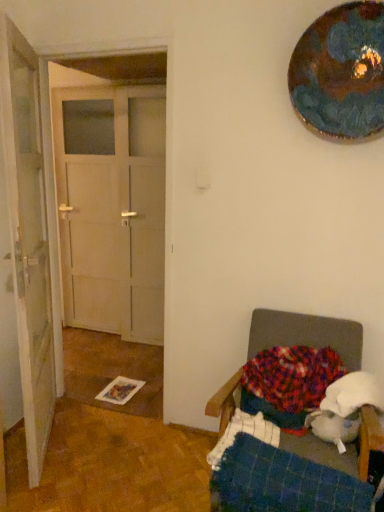
Locate an element on the screen. This screenshot has height=512, width=384. empty space that is to the right of white wooden door at left, acting as the 1th door starting from the left is located at coordinates (121, 448).